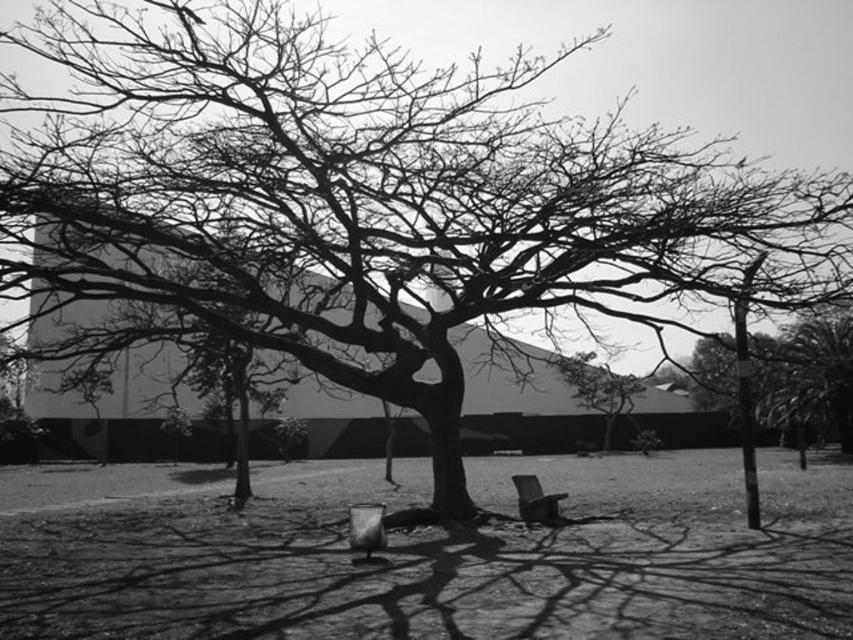
Which of these two, smooth bark tree at center or smooth black chair at center, stands shorter?

Standing shorter between the two is smooth black chair at center.

From the picture: Who is taller, smooth bark tree at center or smooth black chair at center?

smooth bark tree at center

Where is `smooth bark tree at center`? This screenshot has width=853, height=640. smooth bark tree at center is located at coordinates (596, 387).

Does metallic silver chair at center appear over smooth black chair at center?

Correct, metallic silver chair at center is located above smooth black chair at center.

You are a GUI agent. You are given a task and a screenshot of the screen. Output one action in this format:
    pyautogui.click(x=<x>, y=<y>)
    Task: Click on the metallic silver chair at center
    This screenshot has width=853, height=640.
    Given the screenshot: What is the action you would take?
    pyautogui.click(x=366, y=528)

This screenshot has width=853, height=640. Describe the element at coordinates (366, 528) in the screenshot. I see `metallic silver chair at center` at that location.

Where is `metallic silver chair at center`? Image resolution: width=853 pixels, height=640 pixels. metallic silver chair at center is located at coordinates (366, 528).

Who is positioned more to the left, smooth bark tree at center or metallic silver chair at center?

metallic silver chair at center

Can you confirm if smooth bark tree at center is shorter than metallic silver chair at center?

No, smooth bark tree at center is not shorter than metallic silver chair at center.

Which is behind, point (589, 385) or point (366, 544)?

The point (589, 385) is behind.

At what (x,y) coordinates should I click in order to perform the action: click on smooth bark tree at center. Please return your answer as a coordinate pair (x, y). Looking at the image, I should click on (596, 387).